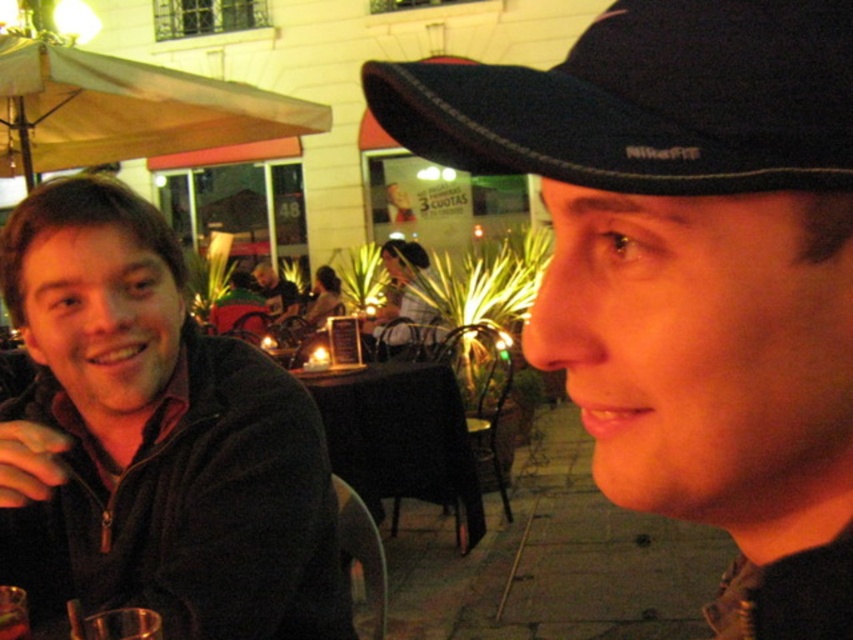
Question: Which object appears farthest from the camera in this image?

Choices:
 (A) black matte table at center
 (B) black nikefit cap at upper right
 (C) dark brown leather jacket at center

Answer: (C)

Question: Is black nikefit cap at upper right to the left of dark brown leather jacket at center from the viewer's perspective?

Choices:
 (A) no
 (B) yes

Answer: (A)

Question: Can you confirm if black matte hat at upper right is positioned to the left of clear glass at lower left?

Choices:
 (A) no
 (B) yes

Answer: (A)

Question: Which is farther from the black matte table at center?

Choices:
 (A) matte black jacket at left
 (B) dark brown leather jacket at center
 (C) clear glass at lower left
 (D) black nikefit cap at upper right

Answer: (D)

Question: Which point is farther to the camera?

Choices:
 (A) clear glass at lower left
 (B) black matte hat at upper right

Answer: (A)

Question: Is matte black jacket at left thinner than clear glass at lower left?

Choices:
 (A) yes
 (B) no

Answer: (B)